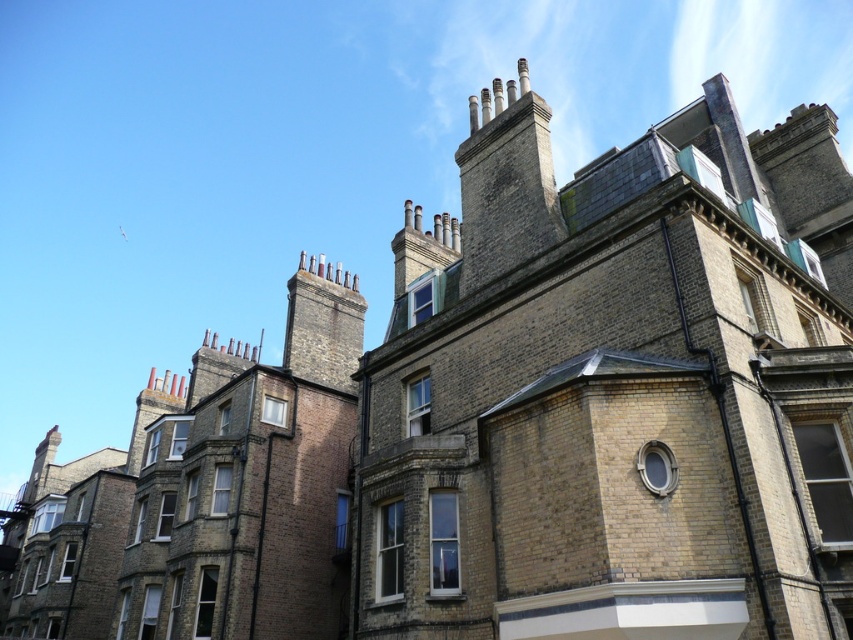
Consider the image. How distant is brown brick chimney at upper center from brown stone chimney at upper center?

A distance of 60.99 feet exists between brown brick chimney at upper center and brown stone chimney at upper center.

Does brown brick chimney at upper center have a larger size compared to brown stone chimney at upper center?

Indeed, brown brick chimney at upper center has a larger size compared to brown stone chimney at upper center.

This screenshot has height=640, width=853. What do you see at coordinates (506, 186) in the screenshot?
I see `brown brick chimney at upper center` at bounding box center [506, 186].

Where is `brown brick chimney at upper center`? This screenshot has width=853, height=640. brown brick chimney at upper center is located at coordinates (506, 186).